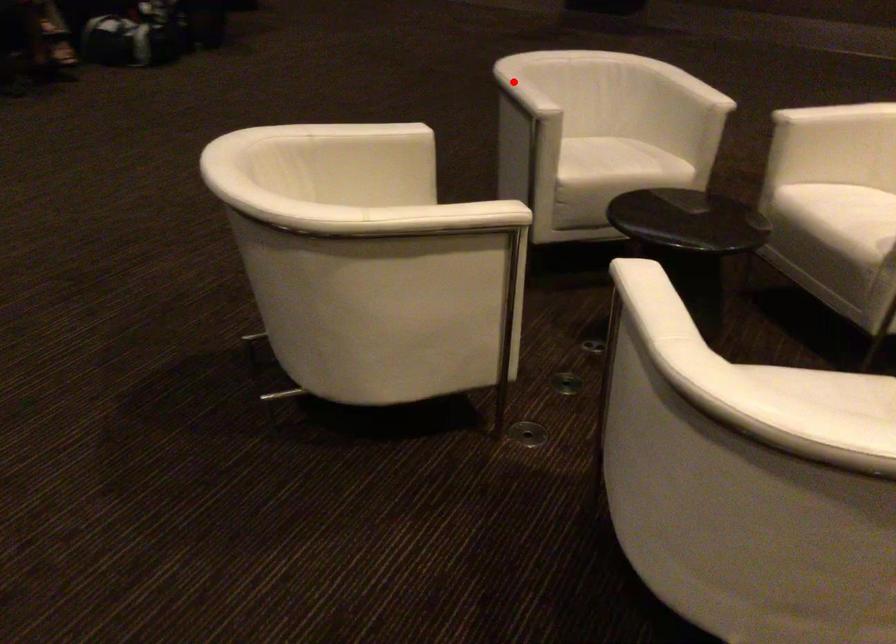
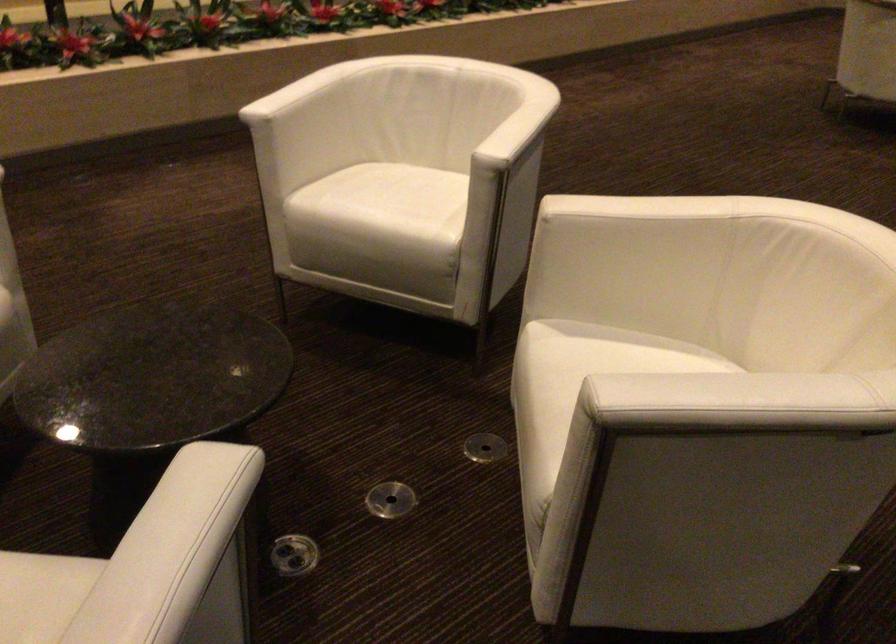
Locate, in the second image, the point that corresponds to the highlighted location in the first image.

(186, 527)